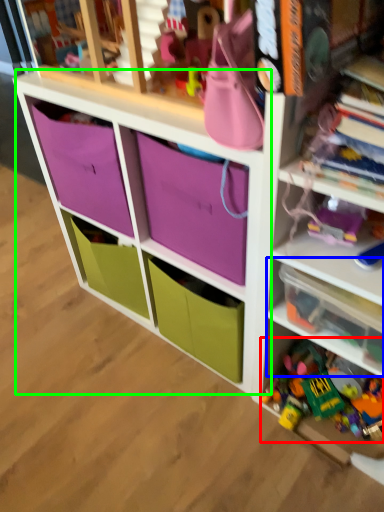
Question: Which object is positioned farthest from toy (highlighted by a red box)? Select from shelf (highlighted by a blue box) and cabinet (highlighted by a green box).

Choices:
 (A) shelf
 (B) cabinet

Answer: (B)